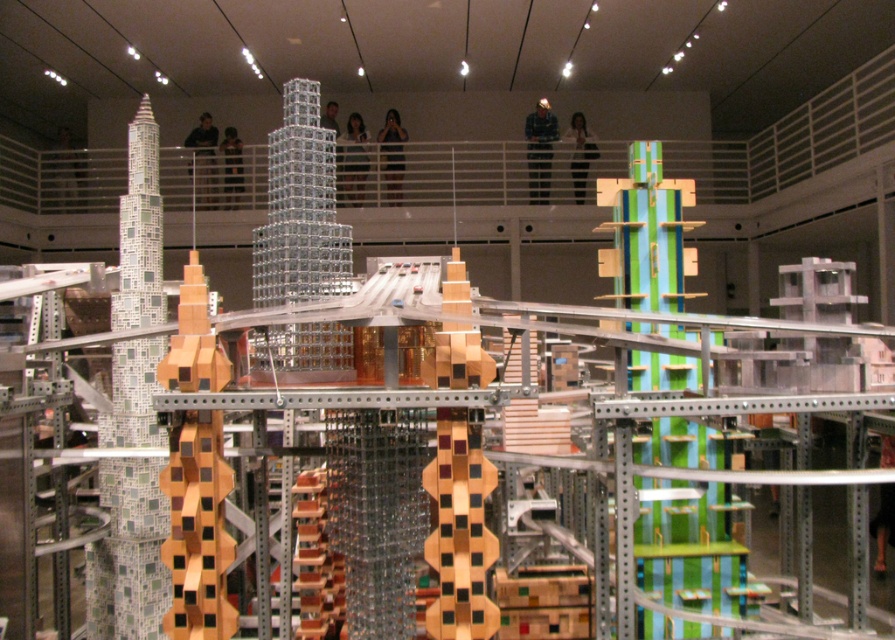
Does green mosaic tower at left appear on the right side of wooden block tower at center-left?

No, green mosaic tower at left is not to the right of wooden block tower at center-left.

Who is positioned more to the right, green mosaic tower at left or wooden block tower at center-left?

wooden block tower at center-left is more to the right.

What do you see at coordinates (128, 554) in the screenshot? I see `green mosaic tower at left` at bounding box center [128, 554].

Find the location of `green mosaic tower at left`. green mosaic tower at left is located at coordinates (128, 554).

In the scene shown: Which of these two, translucent glass tower at center or wooden block tower at center-left, stands shorter?

translucent glass tower at center

In order to click on translucent glass tower at center in this screenshot , I will do `click(300, 209)`.

Which is behind, point (303, 266) or point (211, 438)?

Positioned behind is point (303, 266).

Locate an element on the screen. translucent glass tower at center is located at coordinates (300, 209).

Image resolution: width=895 pixels, height=640 pixels. I want to click on green mosaic tower at left, so click(x=128, y=554).

Which of these two, green mosaic tower at left or translucent glass tower at center, stands taller?

Standing taller between the two is green mosaic tower at left.

Describe the element at coordinates (128, 554) in the screenshot. I see `green mosaic tower at left` at that location.

This screenshot has width=895, height=640. In order to click on green mosaic tower at left in this screenshot , I will do `click(128, 554)`.